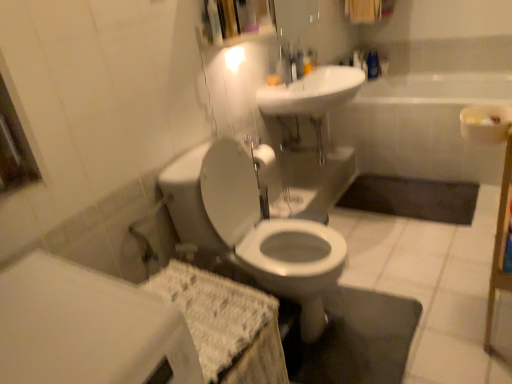
Locate an element on the screen. The image size is (512, 384). vacant area that lies to the right of white glossy toilet at center is located at coordinates (404, 287).